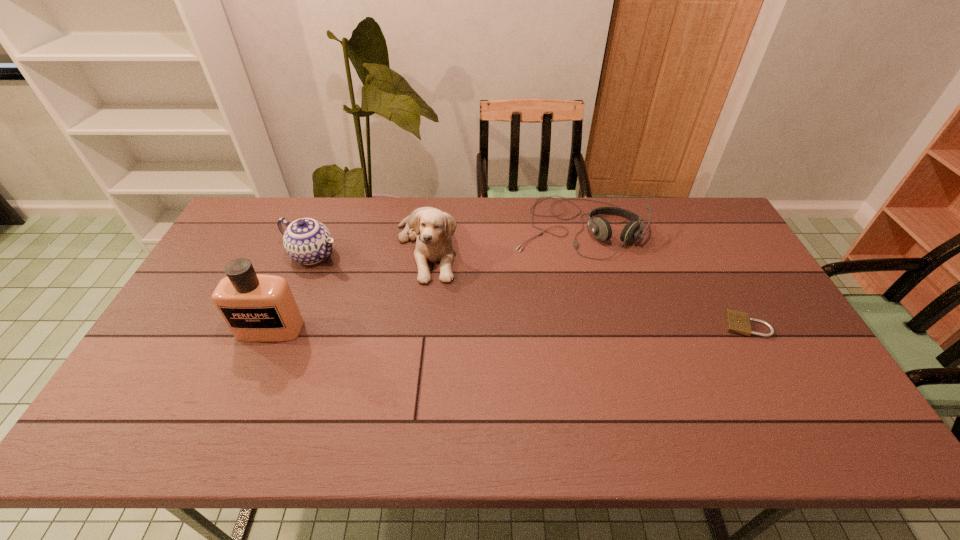
Locate an element on the screen. The height and width of the screenshot is (540, 960). vacant area that lies between the rightmost object and the third tallest object is located at coordinates tap(530, 290).

You are a GUI agent. You are given a task and a screenshot of the screen. Output one action in this format:
    pyautogui.click(x=<x>, y=<y>)
    Task: Click on the vacant space that is in between the rightmost object and the third tallest object
    The image size is (960, 540).
    Given the screenshot: What is the action you would take?
    pyautogui.click(x=530, y=290)

In order to click on vacant area that lies between the second shortest object and the shortest object in this screenshot , I will do `click(661, 275)`.

Find the location of a particular element. The image size is (960, 540). free space between the perfume and the fourth shortest object is located at coordinates (348, 288).

Identify the location of blank region between the third object from left to right and the chinaware. (370, 252).

Identify the location of free spot between the rightmost object and the third object from left to right. Image resolution: width=960 pixels, height=540 pixels. (587, 286).

The width and height of the screenshot is (960, 540). What are the coordinates of `object that is the third closest to the tallest object` in the screenshot? It's located at (600, 227).

Select which object appears as the closest to the rightmost object. Please provide its 2D coordinates. Your answer should be formatted as a tuple, i.e. [(x, y)], where the tuple contains the x and y coordinates of a point satisfying the conditions above.

[(600, 227)]

Identify the location of free space in the image that satisfies the following two spatial constraints: 1. on the back side of the puppy; 2. on the right side of the fourth tallest object. (429, 226).

Find the location of a particular element. vacant space that satisfies the following two spatial constraints: 1. on the front side of the chinaware; 2. on the right side of the padlock is located at coordinates (285, 325).